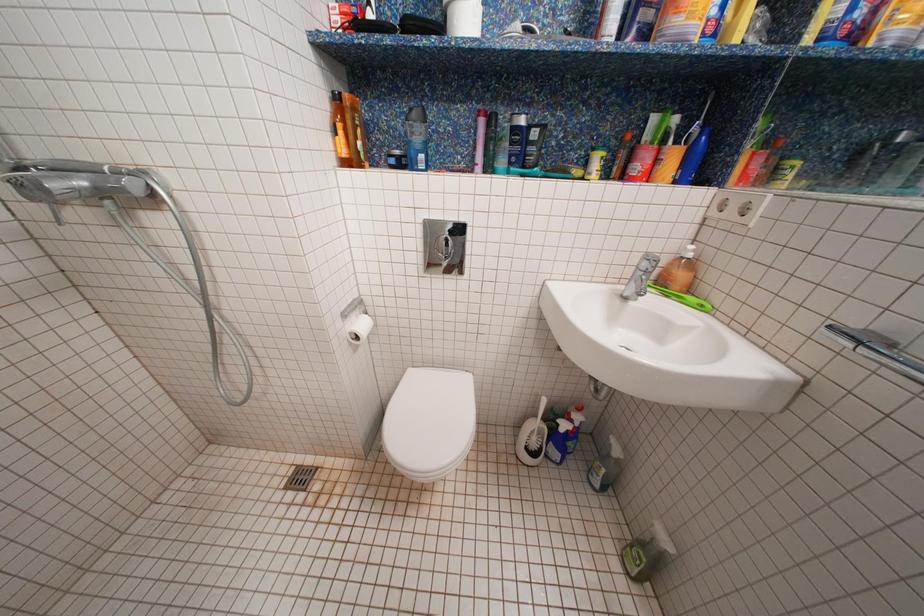
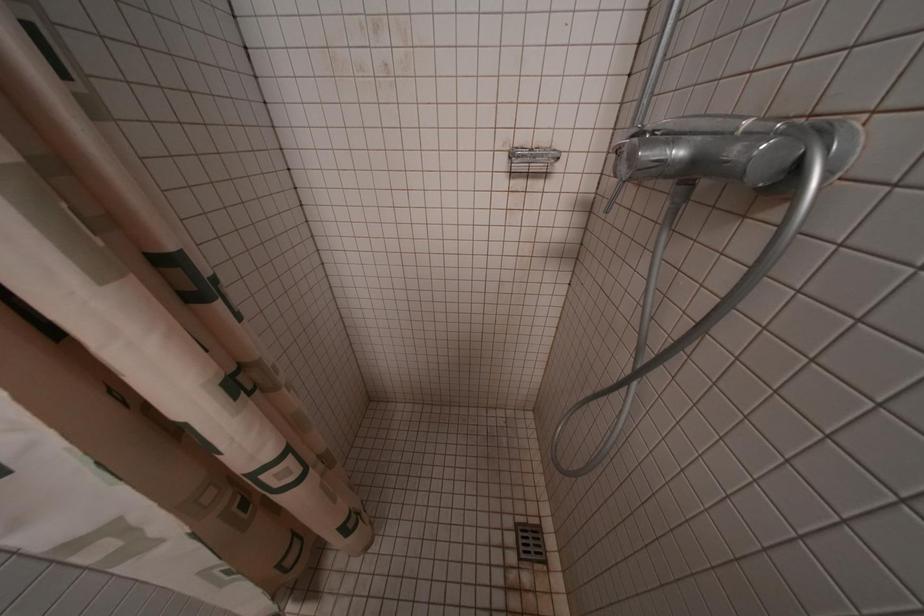
Based on the continuous images, in which direction is the camera rotating?

The camera rotated toward left-down.